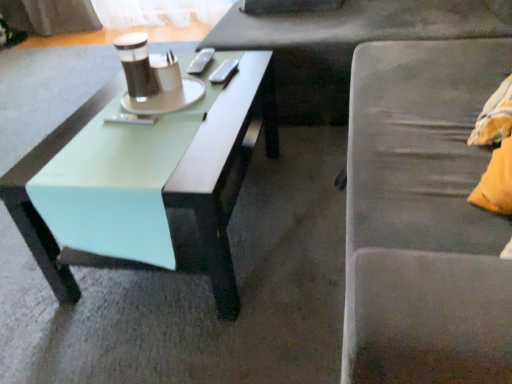
Where is `matte black cup at center`? The width and height of the screenshot is (512, 384). matte black cup at center is located at coordinates (136, 64).

How much space does silver metallic remote control at center, which ranks as the third remote control in left-to-right order, occupy horizontally?

silver metallic remote control at center, which ranks as the third remote control in left-to-right order, is 1.83 inches wide.

What do you see at coordinates (145, 183) in the screenshot? I see `mint green wood coffee table at left` at bounding box center [145, 183].

Image resolution: width=512 pixels, height=384 pixels. What are the coordinates of `matte black cup at center` in the screenshot? It's located at (136, 64).

Is silver metallic remote control at center, which is the second remote control from front to back, positioned in front of mint green wood coffee table at left?

No, it is behind mint green wood coffee table at left.

Does silver metallic remote control at center, which is the second remote control from front to back, have a larger size compared to mint green wood coffee table at left?

Incorrect, silver metallic remote control at center, which is the second remote control from front to back, is not larger than mint green wood coffee table at left.

Is silver metallic remote control at center, positioned as the 2th remote control in back-to-front order, oriented towards mint green wood coffee table at left?

No.

Consider the image. How many degrees apart are the facing directions of silver metallic remote control at center, the 1th remote control in the right-to-left sequence, and mint green wood coffee table at left?

silver metallic remote control at center, the 1th remote control in the right-to-left sequence, and mint green wood coffee table at left are facing 5.55 degrees away from each other.

Considering the relative sizes of matte black cup at center and mint green wood coffee table at left in the image provided, is matte black cup at center shorter than mint green wood coffee table at left?

Indeed, matte black cup at center has a lesser height compared to mint green wood coffee table at left.

Does matte black cup at center contain mint green wood coffee table at left?

No, matte black cup at center does not contain mint green wood coffee table at left.

Considering the sizes of objects matte black cup at center and mint green wood coffee table at left in the image provided, who is bigger, matte black cup at center or mint green wood coffee table at left?

With larger size is mint green wood coffee table at left.

From the image's perspective, relative to mint green wood coffee table at left, is matte black cup at center above or below?

Clearly, from the image's perspective, matte black cup at center is above mint green wood coffee table at left.

Is matte black remote control at center, positioned as the 3th remote control in back-to-front order, taller or shorter than matte black cup at center?

Clearly, matte black remote control at center, positioned as the 3th remote control in back-to-front order, is shorter compared to matte black cup at center.

From the matte black cup at center, count 1st remote control to the right and point to it. Please provide its 2D coordinates.

[(131, 119)]

Which is in front, point (123, 118) or point (144, 34)?

The point (123, 118) is more forward.

From the image's perspective, does matte black remote control at center, marked as the third remote control in a top-to-bottom arrangement, appear lower than matte black cup at center?

Correct, matte black remote control at center, marked as the third remote control in a top-to-bottom arrangement, appears lower than matte black cup at center in the image.

At what (x,y) coordinates should I click in order to perform the action: click on coffee cup below the silver metallic remote control at center, the 1th remote control in the right-to-left sequence (from the image's perspective). Please return your answer as a coordinate pair (x, y). Looking at the image, I should click on (136, 64).

From their relative heights in the image, would you say matte black cup at center is taller or shorter than silver metallic remote control at center, the 1th remote control in the right-to-left sequence?

Clearly, matte black cup at center is taller compared to silver metallic remote control at center, the 1th remote control in the right-to-left sequence.

Looking at their sizes, would you say matte black cup at center is wider or thinner than silver metallic remote control at center, the 1th remote control in the right-to-left sequence?

In the image, matte black cup at center appears to be wider than silver metallic remote control at center, the 1th remote control in the right-to-left sequence.

Considering the relative positions of silver metallic remote control at center, which ranks as the third remote control in left-to-right order, and matte black cup at center in the image provided, is silver metallic remote control at center, which ranks as the third remote control in left-to-right order, to the left or to the right of matte black cup at center?

From the image, it's evident that silver metallic remote control at center, which ranks as the third remote control in left-to-right order, is to the right of matte black cup at center.

From the image's perspective, between silver metallic remote control at center, which is the second remote control from front to back, and matte black cup at center, who is located below?

matte black cup at center, from the image's perspective.

From a real-world perspective, does silver metallic remote control at center, the 2th remote control in the top-to-bottom sequence, sit lower than matte black cup at center?

Indeed, from a real-world perspective, silver metallic remote control at center, the 2th remote control in the top-to-bottom sequence, is positioned beneath matte black cup at center.

Is silver metallic remote control at center, which is the second remote control from front to back, situated inside metallic silver remote control at center, which ranks as the first remote control in top-to-bottom order, or outside?

silver metallic remote control at center, which is the second remote control from front to back, exists outside the volume of metallic silver remote control at center, which ranks as the first remote control in top-to-bottom order.

Who is taller, silver metallic remote control at center, which is the second remote control from front to back, or metallic silver remote control at center, the 2th remote control from the right?

metallic silver remote control at center, the 2th remote control from the right, is taller.

Could you tell me if silver metallic remote control at center, positioned as the 2th remote control in back-to-front order, is facing metallic silver remote control at center, which appears as the 2th remote control when viewed from the left?

Yes, silver metallic remote control at center, positioned as the 2th remote control in back-to-front order, is oriented towards metallic silver remote control at center, which appears as the 2th remote control when viewed from the left.

Is silver metallic remote control at center, the 1th remote control in the right-to-left sequence, next to metallic silver remote control at center, which ranks as the first remote control in top-to-bottom order, and touching it?

They are not placed beside each other.

Is metallic silver remote control at center, placed as the third remote control when sorted from bottom to top, to the right of matte black remote control at center, arranged as the 1th remote control when ordered from the bottom, from the viewer's perspective?

Yes.

Can matte black remote control at center, the 1th remote control viewed from the front, be found inside metallic silver remote control at center, acting as the first remote control starting from the back?

That's incorrect, matte black remote control at center, the 1th remote control viewed from the front, is not inside metallic silver remote control at center, acting as the first remote control starting from the back.

Looking at the image, does metallic silver remote control at center, which appears as the third remote control when viewed from the front, seem bigger or smaller compared to matte black remote control at center, positioned as the 3th remote control in back-to-front order?

Considering their sizes, metallic silver remote control at center, which appears as the third remote control when viewed from the front, takes up more space than matte black remote control at center, positioned as the 3th remote control in back-to-front order.

At what (x,y) coordinates should I click in order to perform the action: click on coffee table in front of the silver metallic remote control at center, the 1th remote control in the right-to-left sequence. Please return your answer as a coordinate pair (x, y). The image size is (512, 384). Looking at the image, I should click on (145, 183).

Locate an element on the screen. coffee cup that appears above the mint green wood coffee table at left (from the image's perspective) is located at coordinates (136, 64).

Based on the photo, from the image, which object appears to be nearer to silver metallic remote control at center, which ranks as the third remote control in left-to-right order, mint green wood coffee table at left or matte black cup at center?

matte black cup at center.

Considering their positions, is metallic silver remote control at center, placed as the third remote control when sorted from bottom to top, positioned closer to matte black remote control at center, arranged as the 1th remote control when viewed from the left, than mint green wood coffee table at left?

mint green wood coffee table at left lies closer to matte black remote control at center, arranged as the 1th remote control when viewed from the left, than the other object.

Estimate the real-world distances between objects in this image. Which object is further from metallic silver remote control at center, the 2th remote control from the right, matte black cup at center or mint green wood coffee table at left?

The object further to metallic silver remote control at center, the 2th remote control from the right, is mint green wood coffee table at left.

Which object lies nearer to the anchor point metallic silver remote control at center, which ranks as the first remote control in top-to-bottom order, matte black cup at center or matte black remote control at center, arranged as the 1th remote control when viewed from the left?

matte black cup at center is closer to metallic silver remote control at center, which ranks as the first remote control in top-to-bottom order.

Looking at the image, which one is located further to silver metallic remote control at center, the 1th remote control in the right-to-left sequence, metallic silver remote control at center, which appears as the third remote control when viewed from the front, or matte black cup at center?

matte black cup at center lies further to silver metallic remote control at center, the 1th remote control in the right-to-left sequence, than the other object.

From the picture: Based on their spatial positions, is silver metallic remote control at center, positioned as the 2th remote control in back-to-front order, or matte black cup at center closer to metallic silver remote control at center, the 2th remote control from the right?

silver metallic remote control at center, positioned as the 2th remote control in back-to-front order, lies closer to metallic silver remote control at center, the 2th remote control from the right, than the other object.

Looking at the image, which one is located further to matte black remote control at center, positioned as the 3th remote control in back-to-front order, matte black cup at center or metallic silver remote control at center, which ranks as the first remote control in top-to-bottom order?

metallic silver remote control at center, which ranks as the first remote control in top-to-bottom order, is positioned further to the anchor matte black remote control at center, positioned as the 3th remote control in back-to-front order.

When comparing their distances from mint green wood coffee table at left, does matte black cup at center or metallic silver remote control at center, the 2th remote control from the right, seem further?

The object further to mint green wood coffee table at left is metallic silver remote control at center, the 2th remote control from the right.

Find the location of a particular element. Image resolution: width=512 pixels, height=384 pixels. coffee cup positioned between mint green wood coffee table at left and silver metallic remote control at center, the 1th remote control in the right-to-left sequence, from near to far is located at coordinates (136, 64).

Identify the location of coffee cup positioned between mint green wood coffee table at left and metallic silver remote control at center, the 2th remote control from the right, from near to far. (136, 64).

Locate an element on the screen. The height and width of the screenshot is (384, 512). remote control between metallic silver remote control at center, the 2th remote control from the right, and matte black remote control at center, arranged as the 1th remote control when viewed from the left, vertically is located at coordinates (223, 71).

Where is `coffee cup between matte black remote control at center, arranged as the 1th remote control when ordered from the bottom, and metallic silver remote control at center, the 2th remote control from the right, along the z-axis`? coffee cup between matte black remote control at center, arranged as the 1th remote control when ordered from the bottom, and metallic silver remote control at center, the 2th remote control from the right, along the z-axis is located at coordinates (136, 64).